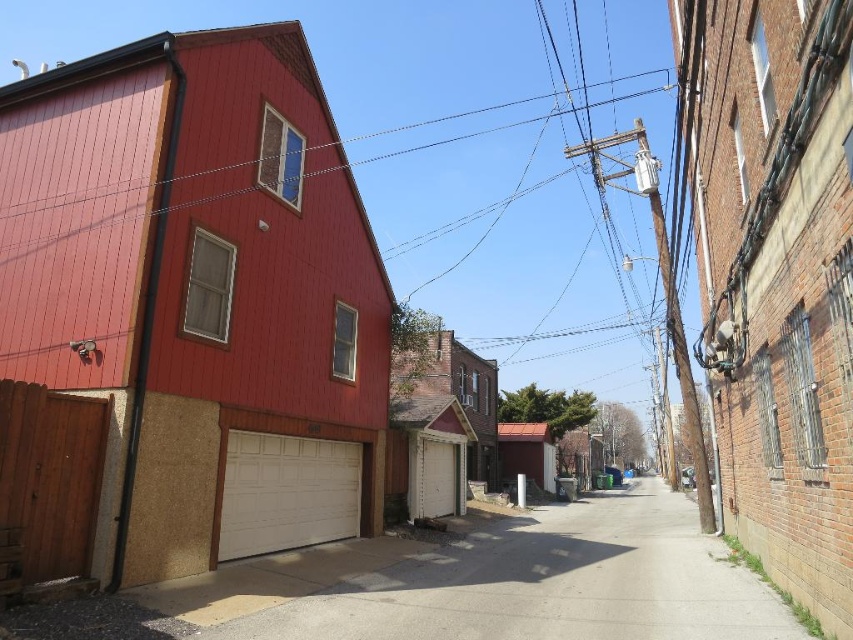
Question: Is white smooth driveway at lower center further to camera compared to white textured garage door at lower center?

Choices:
 (A) yes
 (B) no

Answer: (B)

Question: Which object appears closest to the camera in this image?

Choices:
 (A) white smooth driveway at lower center
 (B) white textured garage door at lower center

Answer: (A)

Question: Does white smooth driveway at lower center have a greater width compared to white textured garage door at lower center?

Choices:
 (A) no
 (B) yes

Answer: (B)

Question: In this image, where is white smooth driveway at lower center located relative to white textured garage door at lower center?

Choices:
 (A) right
 (B) left

Answer: (A)

Question: Which object appears farthest from the camera in this image?

Choices:
 (A) white textured garage door at lower center
 (B) white smooth driveway at lower center

Answer: (A)

Question: Among these objects, which one is nearest to the camera?

Choices:
 (A) white smooth driveway at lower center
 (B) white painted wood garage at center
 (C) white textured garage door at lower center

Answer: (A)